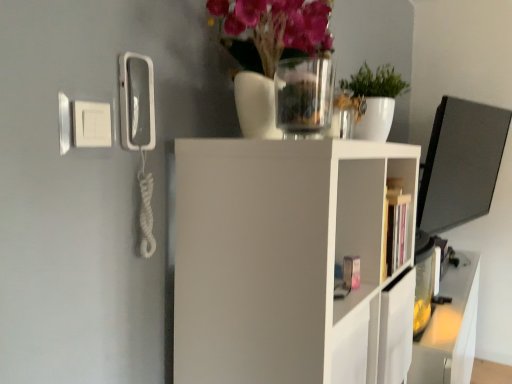
Identify the location of green matte plant at upper center. The image size is (512, 384). (375, 99).

What is the approximate height of translucent glass vase at upper center?

translucent glass vase at upper center is 18.67 inches in height.

This screenshot has height=384, width=512. In order to click on matte plastic cabinet at center in this screenshot , I will do `click(359, 225)`.

Does transparent glass vase at upper center contain matte plastic cabinet at center?

No, matte plastic cabinet at center is located outside of transparent glass vase at upper center.

How different are the orientations of transparent glass vase at upper center and matte plastic cabinet at center in degrees?

The angle between the facing direction of transparent glass vase at upper center and the facing direction of matte plastic cabinet at center is 1.11 degrees.

Is transparent glass vase at upper center wider or thinner than matte plastic cabinet at center?

Clearly, transparent glass vase at upper center has less width compared to matte plastic cabinet at center.

Looking at this image, is transparent glass vase at upper center oriented away from matte plastic cabinet at center?

No.

Is matte plastic cabinet at center aimed at green matte plant at upper center?

No, matte plastic cabinet at center is not aimed at green matte plant at upper center.

Considering the positions of objects matte plastic cabinet at center and green matte plant at upper center in the image provided, who is more to the left, matte plastic cabinet at center or green matte plant at upper center?

matte plastic cabinet at center.

Is there a large distance between matte plastic cabinet at center and green matte plant at upper center?

No, matte plastic cabinet at center is in close proximity to green matte plant at upper center.

What's the angular difference between translucent glass vase at upper center and transparent glass vase at upper center's facing directions?

There is a 0.538-degree angle between the facing directions of translucent glass vase at upper center and transparent glass vase at upper center.

Is transparent glass vase at upper center a part of translucent glass vase at upper center?

Definitely not — transparent glass vase at upper center is not inside translucent glass vase at upper center.

Which object is thinner, translucent glass vase at upper center or transparent glass vase at upper center?

transparent glass vase at upper center is thinner.

Is matte plastic cabinet at center a part of white matte shelf at center?

Indeed, matte plastic cabinet at center is located within white matte shelf at center.

Between point (254, 279) and point (355, 197), which one is positioned behind?

Point (355, 197)

Based on the photo, from the image's perspective, is white matte shelf at center under matte plastic cabinet at center?

Yes, from the image's perspective, white matte shelf at center is below matte plastic cabinet at center.

From the image's perspective, is transparent glass vase at upper center below green matte plant at upper center?

Correct, transparent glass vase at upper center appears lower than green matte plant at upper center in the image.

Find the location of a particular element. The image size is (512, 384). houseplant above the transparent glass vase at upper center (from a real-world perspective) is located at coordinates (375, 99).

Considering the sizes of objects transparent glass vase at upper center and green matte plant at upper center in the image provided, who is taller, transparent glass vase at upper center or green matte plant at upper center?

With more height is green matte plant at upper center.

Consider the image. Is translucent glass vase at upper center not close to green matte plant at upper center?

Actually, translucent glass vase at upper center and green matte plant at upper center are a little close together.

Is translucent glass vase at upper center bigger than green matte plant at upper center?

Yes, translucent glass vase at upper center is bigger than green matte plant at upper center.

Is translucent glass vase at upper center oriented away from green matte plant at upper center?

No, translucent glass vase at upper center is not facing away from green matte plant at upper center.

Can you confirm if translucent glass vase at upper center is shorter than green matte plant at upper center?

No, translucent glass vase at upper center is not shorter than green matte plant at upper center.

How different are the orientations of green matte plant at upper center and matte plastic cabinet at center in degrees?

green matte plant at upper center and matte plastic cabinet at center are facing 1.11 degrees away from each other.

Is matte plastic cabinet at center at the back of green matte plant at upper center?

That's not correct — green matte plant at upper center is not looking away from matte plastic cabinet at center.

Is green matte plant at upper center taller than matte plastic cabinet at center?

No, green matte plant at upper center is not taller than matte plastic cabinet at center.

Identify the location of glass vase in front of the matte plastic cabinet at center. The height and width of the screenshot is (384, 512). (304, 97).

This screenshot has height=384, width=512. What are the coordinates of `houseplant above the matte plastic cabinet at center (from a real-world perspective)` in the screenshot? It's located at (375, 99).

Considering their positions, is white matte shelf at center positioned closer to transparent glass vase at upper center than green matte plant at upper center?

green matte plant at upper center is positioned closer to the anchor transparent glass vase at upper center.

From the image, which object appears to be farther from white matte shelf at center, translucent glass vase at upper center or green matte plant at upper center?

The object further to white matte shelf at center is green matte plant at upper center.

Estimate the real-world distances between objects in this image. Which object is further from white matte shelf at center, transparent glass vase at upper center or translucent glass vase at upper center?

translucent glass vase at upper center lies further to white matte shelf at center than the other object.

Which object lies further to the anchor point matte plastic cabinet at center, green matte plant at upper center or translucent glass vase at upper center?

translucent glass vase at upper center lies further to matte plastic cabinet at center than the other object.

Looking at the image, which one is located further to green matte plant at upper center, translucent glass vase at upper center or white matte shelf at center?

Based on the image, white matte shelf at center appears to be further to green matte plant at upper center.

Which object lies further to the anchor point green matte plant at upper center, transparent glass vase at upper center or translucent glass vase at upper center?

Based on the image, translucent glass vase at upper center appears to be further to green matte plant at upper center.

Based on their spatial positions, is matte plastic cabinet at center or white matte shelf at center closer to translucent glass vase at upper center?

white matte shelf at center is positioned closer to the anchor translucent glass vase at upper center.

When comparing their distances from translucent glass vase at upper center, does transparent glass vase at upper center or matte plastic cabinet at center seem closer?

transparent glass vase at upper center lies closer to translucent glass vase at upper center than the other object.

The height and width of the screenshot is (384, 512). In order to click on glass vase between translucent glass vase at upper center and white matte shelf at center vertically in this screenshot , I will do `click(304, 97)`.

Locate an element on the screen. This screenshot has width=512, height=384. cabinet between translucent glass vase at upper center and white matte shelf at center in the up-down direction is located at coordinates (359, 225).

Identify the location of glass vase between green matte plant at upper center and white matte shelf at center in the vertical direction. (304, 97).

This screenshot has height=384, width=512. What are the coordinates of `cabinet between transparent glass vase at upper center and white matte shelf at center in the vertical direction` in the screenshot? It's located at (359, 225).